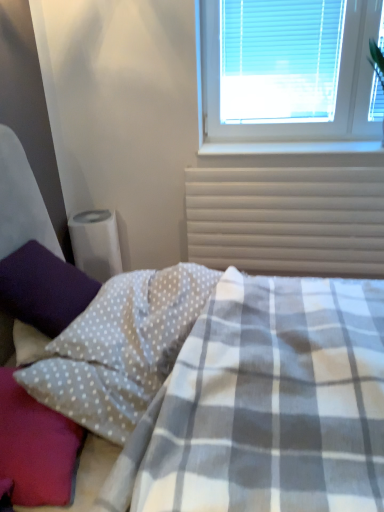
Locate an element on the screen. blank space above white plastic radiator at upper right (from a real-world perspective) is located at coordinates (292, 163).